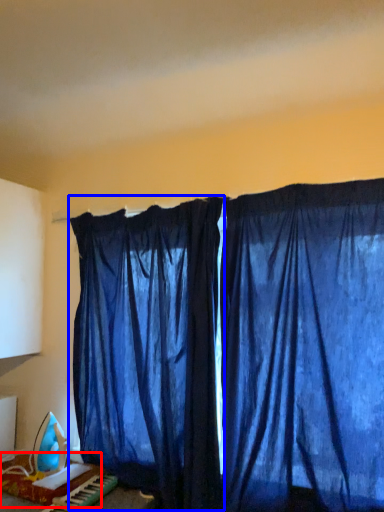
Question: Which object is closer to the camera taking this photo, furniture (highlighted by a red box) or curtain (highlighted by a blue box)?

Choices:
 (A) furniture
 (B) curtain

Answer: (B)